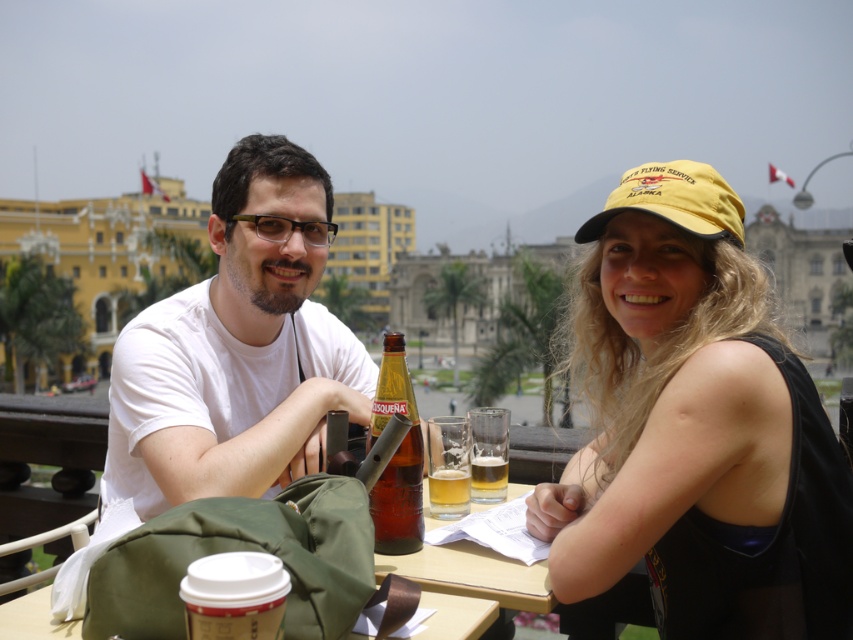
Question: Which of the following is the farthest from the observer?

Choices:
 (A) (468, 604)
 (B) (640, 412)
 (C) (498, 493)

Answer: (C)

Question: Can you confirm if white matte t-shirt at center is positioned to the right of brown glass bottle at center?

Choices:
 (A) no
 (B) yes

Answer: (B)

Question: Estimate the real-world distances between objects in this image. Which object is closer to the yellow fabric baseball cap at upper right?

Choices:
 (A) translucent glass beer at center
 (B) matte plastic cup at lower center
 (C) brown glass bottle at center

Answer: (A)

Question: Is matte plastic cup at lower center to the right of translucent glass at table center from the viewer's perspective?

Choices:
 (A) no
 (B) yes

Answer: (A)

Question: Estimate the real-world distances between objects in this image. Which object is farther from the translucent glass at table center?

Choices:
 (A) yellow fabric cap at upper right
 (B) white matte t-shirt at center

Answer: (A)

Question: Where is white matte t-shirt at center located in relation to translucent glass at table center in the image?

Choices:
 (A) left
 (B) right

Answer: (B)